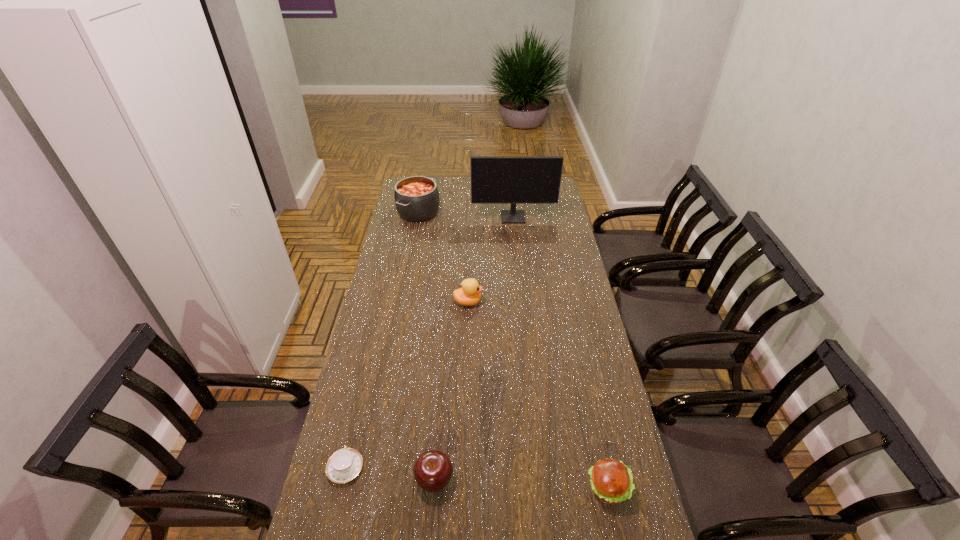
The width and height of the screenshot is (960, 540). Find the location of `vacant space that is in between the hamburger and the tallest object`. vacant space that is in between the hamburger and the tallest object is located at coordinates coord(561,353).

In order to click on empty space that is in between the apple and the shortest object in this screenshot , I will do `click(390, 474)`.

Locate an element on the screen. Image resolution: width=960 pixels, height=540 pixels. object that is the second closest to the shortest object is located at coordinates (611, 481).

Identify the location of object that is the third nearest to the tallest object. (433, 470).

Identify the location of free point that satisfies the following two spatial constraints: 1. on the front side of the hamburger; 2. on the left side of the casserole. The width and height of the screenshot is (960, 540). (366, 488).

The image size is (960, 540). In order to click on vacant space that satisfies the following two spatial constraints: 1. on the front-facing side of the hamburger; 2. on the right side of the computer monitor in this screenshot , I will do `click(540, 488)`.